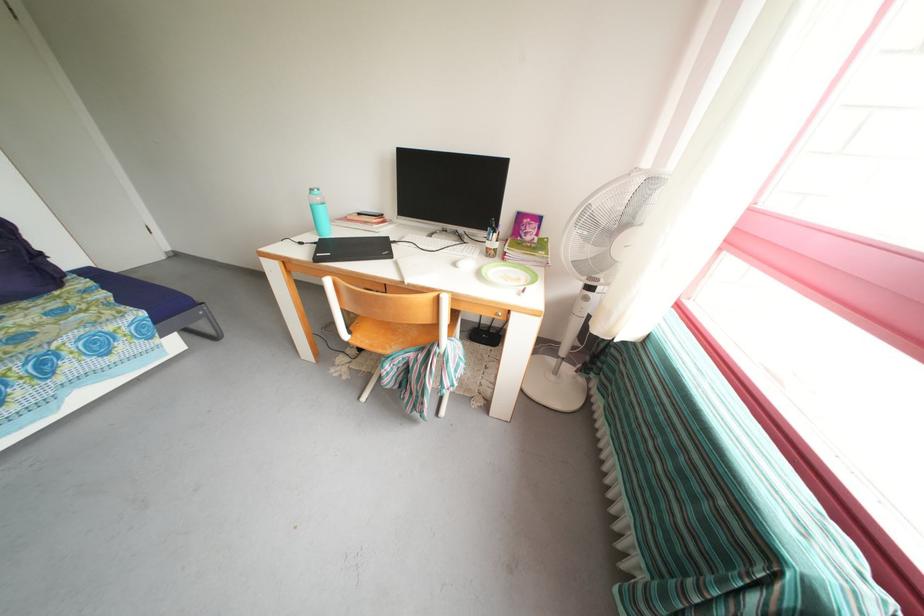
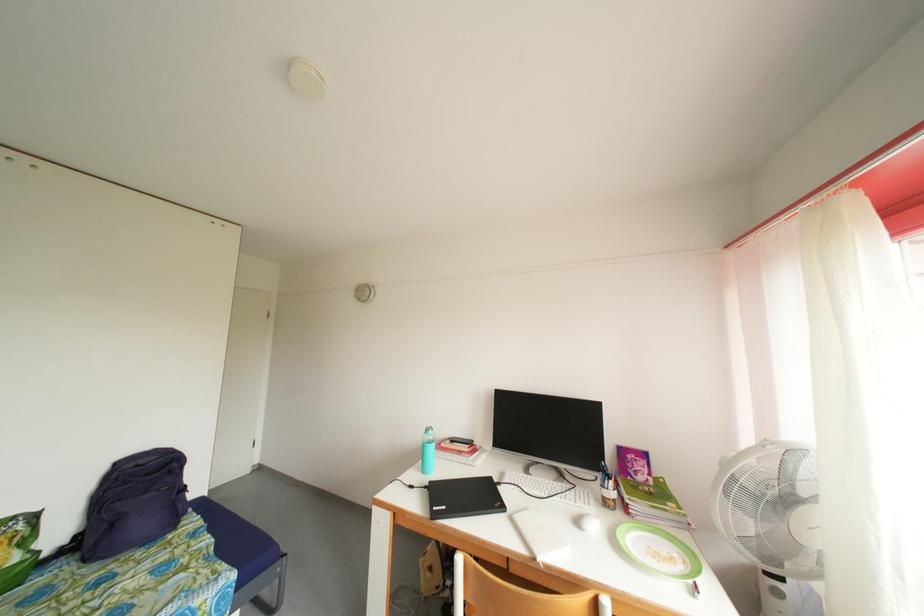
The point at (462, 269) is marked in the first image. Where is the corresponding point in the second image?

(585, 528)